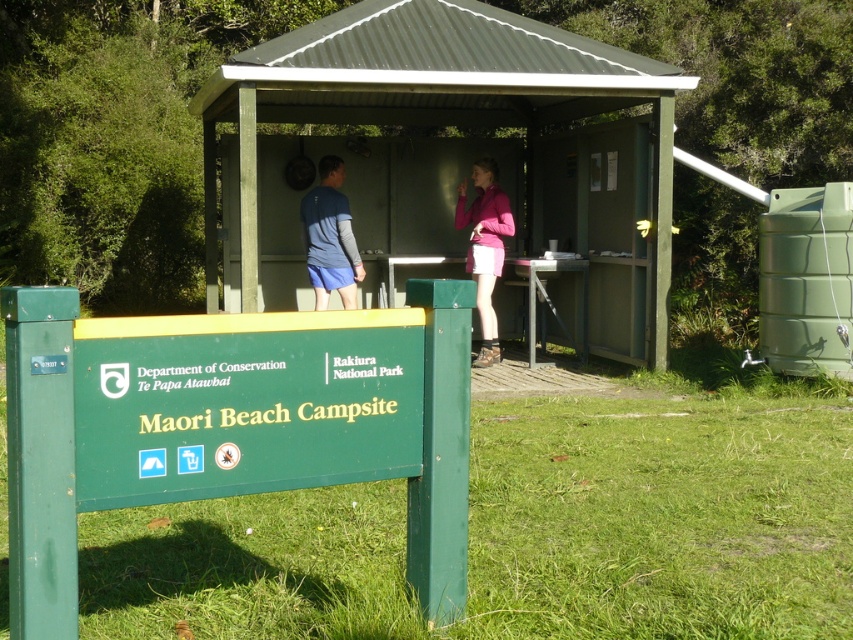
You are a visitor at Maori Beach Campsite and notice two pink items at the center of the scene. Which one is closer to you, the matte pink shirt at center or the pink matte skirt at center?

The matte pink shirt at center is closer to you because it is in front of the pink matte skirt at center.

Looking at this image, you are a hiker planning to join the two people inside the shelter at Maori Beach Campsite. You notice the matte pink shirt at center and the pink matte skirt at center. Which clothing item would you say is bigger in size?

The matte pink shirt at center is larger in size than the pink matte skirt at center.

You are standing at the entrance of the campsite and need to place a 6 meter long tent. The tent must be placed such that it does not come within 1 meter of any existing objects. Is there enough space between the green painted wood sign at lower left and the matte blue shirt at center to place the tent?

The distance between the green painted wood sign at lower left and the matte blue shirt at center is 5.85 meters. Since the tent is 6 meters long and requires a 1 meter buffer on each end, the total required space would be 6 meters plus 2 meters, totaling 8 meters. Since 5.85 meters is less than 8 meters, there is not enough space to place the tent between them.